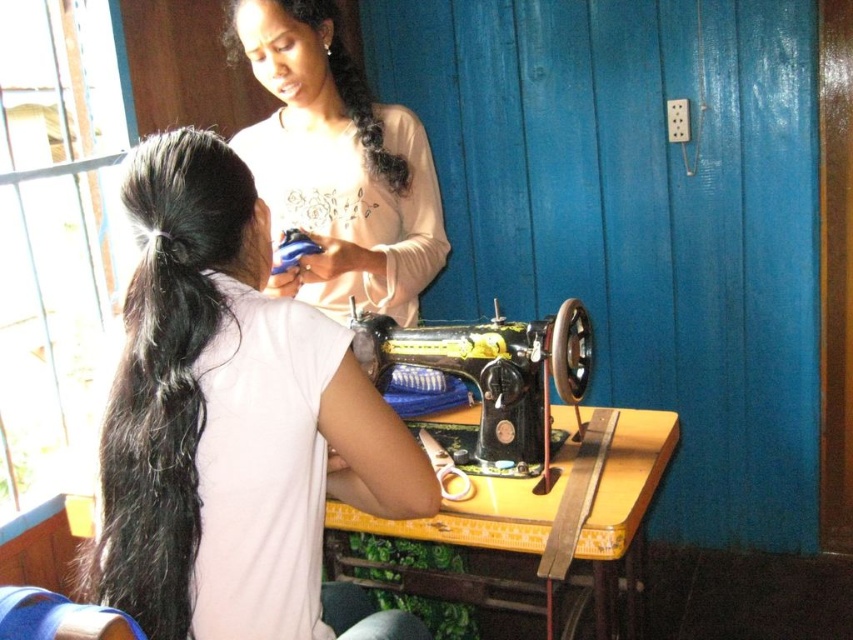
You are trying to decide where to place a new sewing kit. The matte white shirt at upper center and the yellow wood table at center are both in view. Which object would you choose to place the kit near if you want it to be closer to the larger object?

The matte white shirt at upper center is bigger than the yellow wood table at center, so placing the sewing kit near the matte white shirt at upper center would position it closer to the larger object.

You are trying to reach the scissors on the table but there is a sewing machine in the way. Which object is closer to you, the black metal sewing machine at center or the yellow wood table at center?

The yellow wood table at center is closer to you because the black metal sewing machine at center is above it, meaning the table is beneath the sewing machine and therefore closer to your reach.

You are a photographer standing in the room and want to take a closeup photo of the matte white shirt at upper center. The camera you are using has a minimum focusing distance of 1.5 meters. Can you take the photo without moving closer than the minimum focusing distance?

The matte white shirt at upper center is 1.41 meters away from the camera, which is within the minimum focusing distance of 1.5 meters. Therefore, you can take the photo without moving closer than the minimum focusing distance.